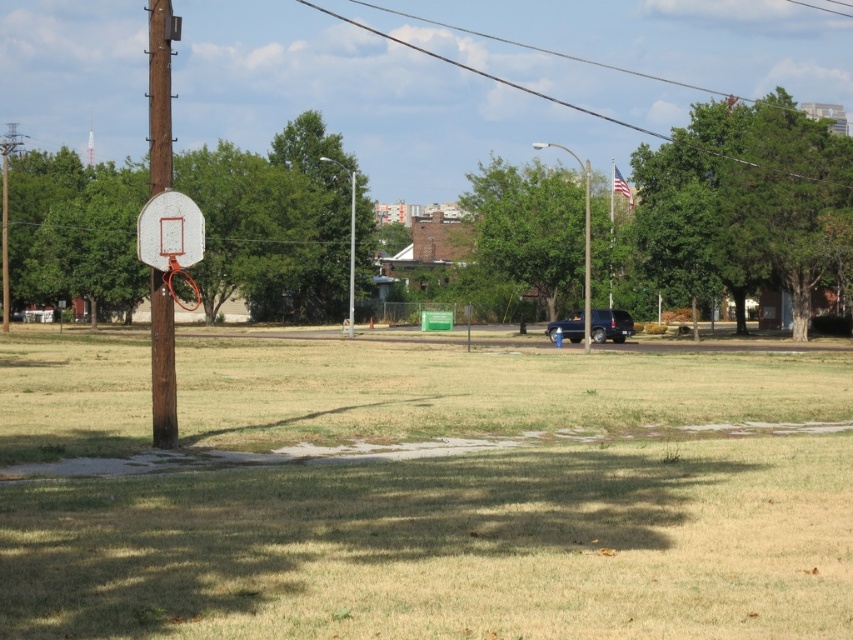
Question: Which of the following is the closest to the observer?

Choices:
 (A) (265, 568)
 (B) (722, 184)

Answer: (A)

Question: Which point is closer to the camera?

Choices:
 (A) (270, 236)
 (B) (556, 372)
 (C) (163, 104)

Answer: (C)

Question: Which of the following is the closest to the observer?

Choices:
 (A) brown wood pole at left
 (B) green leafy tree at upper right
 (C) green leafy tree at center

Answer: (A)

Question: Can you confirm if green leafy tree at center is positioned to the left of white glossy basketball hoop at left?

Choices:
 (A) no
 (B) yes

Answer: (A)

Question: Does green leafy tree at left appear over green leafy tree at center?

Choices:
 (A) no
 (B) yes

Answer: (B)

Question: Can you confirm if green leafy tree at center is positioned to the right of brown wood pole at left?

Choices:
 (A) yes
 (B) no

Answer: (A)